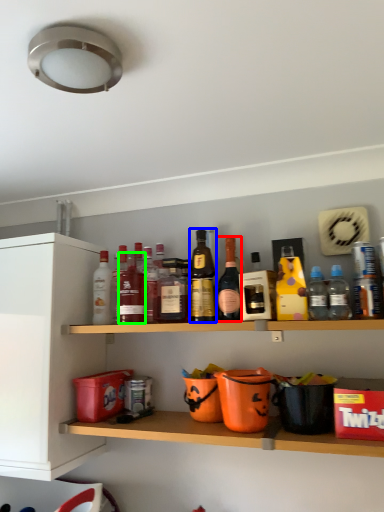
Question: Considering the real-world distances, which object is farthest from bottle (highlighted by a red box)? bottle (highlighted by a blue box) or bottle (highlighted by a green box)?

Choices:
 (A) bottle
 (B) bottle

Answer: (B)